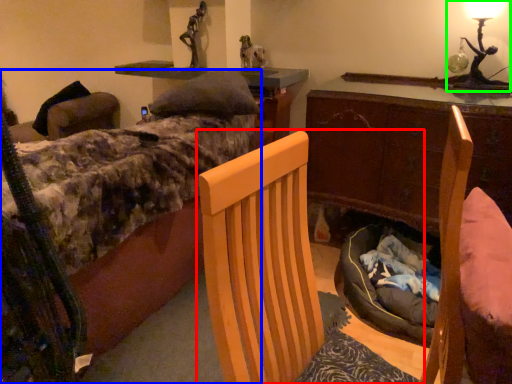
Question: Considering the real-world distances, which object is closest to chair (highlighted by a red box)? bed (highlighted by a blue box) or table lamp (highlighted by a green box).

Choices:
 (A) bed
 (B) table lamp

Answer: (A)